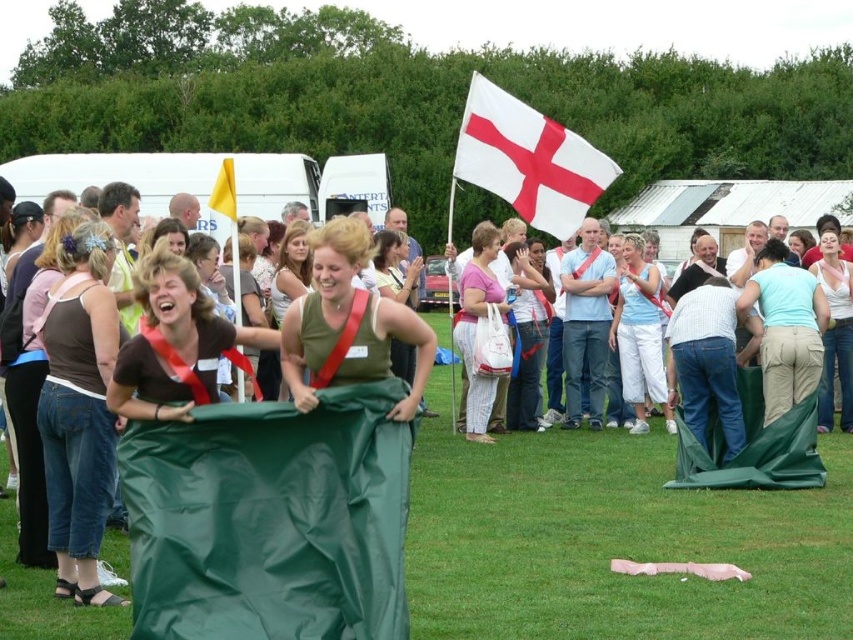
Question: Which point appears farthest from the camera in this image?

Choices:
 (A) (519, 150)
 (B) (233, 186)
 (C) (340, 280)

Answer: (A)

Question: Does brown fabric tank top at left lie in front of brown fabric bag at center?

Choices:
 (A) yes
 (B) no

Answer: (B)

Question: Does brown fabric tank top at left appear on the right side of matte green fabric at center?

Choices:
 (A) yes
 (B) no

Answer: (B)

Question: Does matte green fabric at center lie behind white matte tank top at center?

Choices:
 (A) no
 (B) yes

Answer: (A)

Question: Which point is farther from the camera taking this photo?

Choices:
 (A) (463, 106)
 (B) (842, 323)
 (C) (283, 320)
 (D) (659, 323)

Answer: (A)

Question: Among these objects, which one is nearest to the camera?

Choices:
 (A) white cotton tank top at center
 (B) brown fabric bag at center

Answer: (B)